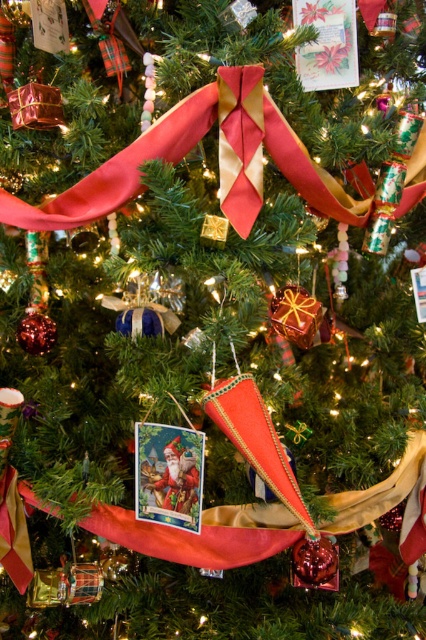
Does point (5, 209) lie in front of point (160, 509)?

Yes, point (5, 209) is in front of point (160, 509).

Is point (250, 225) farther from camera compared to point (170, 492)?

That is False.

Between point (72, 193) and point (166, 452), which one is positioned in front?

Point (166, 452) is in front.

The image size is (426, 640). Identify the location of silky red ribbon at center. (190, 148).

Is the position of silky red ribbon at center less distant than that of matte paper card at upper center?

Yes, it is.

Does point (66, 216) lie behind point (310, 84)?

That is False.

This screenshot has width=426, height=640. I want to click on silky red ribbon at center, so click(x=190, y=148).

Can you confirm if matte paper card at center is positioned to the left of matte paper card at upper center?

Yes, matte paper card at center is to the left of matte paper card at upper center.

Which is below, matte paper card at center or matte paper card at upper center?

matte paper card at center is lower down.

Who is more forward, [138,465] or [305,10]?

Point [138,465] is in front.

You are a GUI agent. You are given a task and a screenshot of the screen. Output one action in this format:
    pyautogui.click(x=<x>, y=<y>)
    Task: Click on the matte paper card at center
    The height and width of the screenshot is (640, 426).
    Given the screenshot: What is the action you would take?
    pyautogui.click(x=169, y=474)